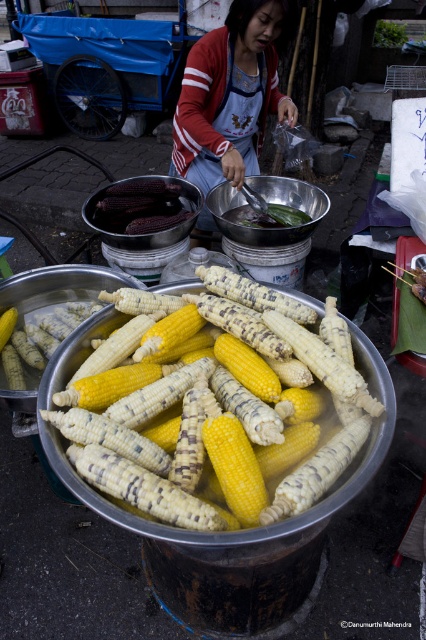
Which of these two, red and white striped sweater at center or purple matte corn at center, stands taller?

red and white striped sweater at center

Describe the element at coordinates (232, 93) in the screenshot. The width and height of the screenshot is (426, 640). I see `red and white striped sweater at center` at that location.

Between point (201, 228) and point (149, 205), which one is positioned behind?

The point (201, 228) is more distant.

Identify the location of red and white striped sweater at center. (232, 93).

Measure the distance between yellow matte corn at center and red and white striped sweater at center.

They are 4.94 feet apart.

Is point (380, 358) positioned before point (279, 100)?

Yes, it is in front of point (279, 100).

Describe the element at coordinates (66, 442) in the screenshot. The height and width of the screenshot is (640, 426). I see `yellow matte corn at center` at that location.

Locate an element on the screen. yellow matte corn at center is located at coordinates (66, 442).

Is yellow matte corn at center taller than purple matte corn at center?

Yes.

Does yellow matte corn at center appear over purple matte corn at center?

Incorrect, yellow matte corn at center is not positioned above purple matte corn at center.

Identify the location of yellow matte corn at center. The image size is (426, 640). (66, 442).